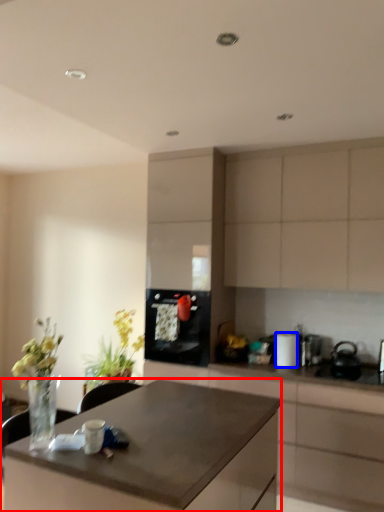
Question: Among these objects, which one is nearest to the camera, desk (highlighted by a red box) or appliance (highlighted by a blue box)?

Choices:
 (A) desk
 (B) appliance

Answer: (A)